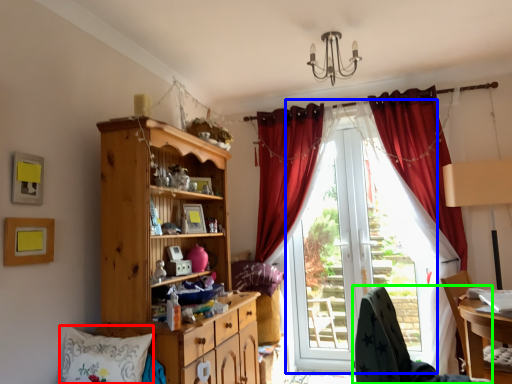
Question: Considering the real-world distances, which object is closest to pillow (highlighted by a red box)? window screen (highlighted by a blue box) or chair (highlighted by a green box).

Choices:
 (A) window screen
 (B) chair

Answer: (B)